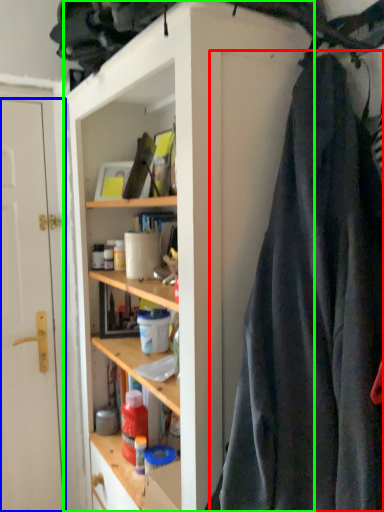
Question: Which object is positioned closest to clothing (highlighted by a red box)? Select from door (highlighted by a blue box) and cabinetry (highlighted by a green box).

Choices:
 (A) door
 (B) cabinetry

Answer: (B)